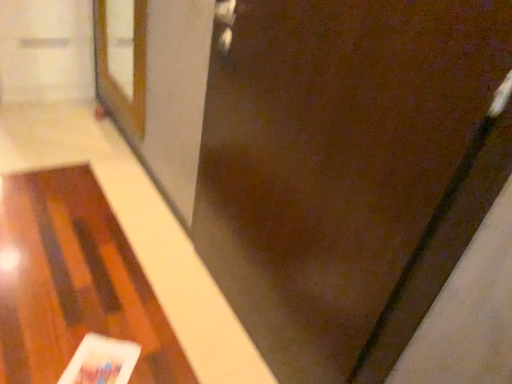
The height and width of the screenshot is (384, 512). I want to click on vacant area situated below brown wooden screen door at upper left (from a real-world perspective), so click(x=127, y=149).